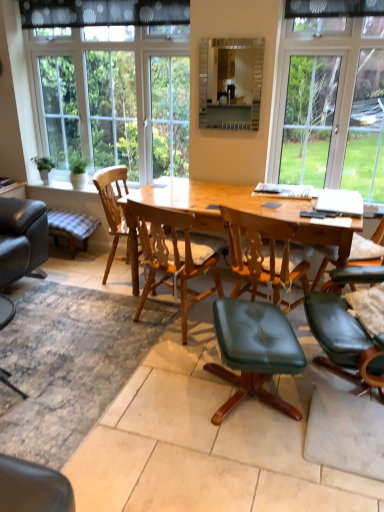
Find the location of a particular element. This screenshot has width=384, height=512. vacant area in front of plaid fabric stool at lower left is located at coordinates (64, 270).